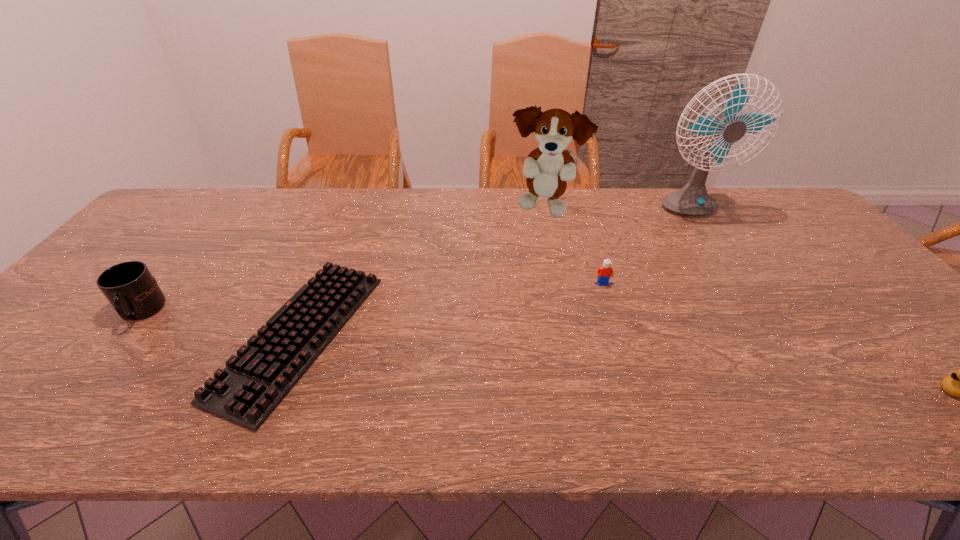
Identify which object is located as the fourth nearest to the puppy. Please provide its 2D coordinates. Your answer should be formatted as a tuple, i.e. [(x, y)], where the tuple contains the x and y coordinates of a point satisfying the conditions above.

[(959, 384)]

The height and width of the screenshot is (540, 960). I want to click on object that stands as the second closest to the duckling, so click(x=605, y=271).